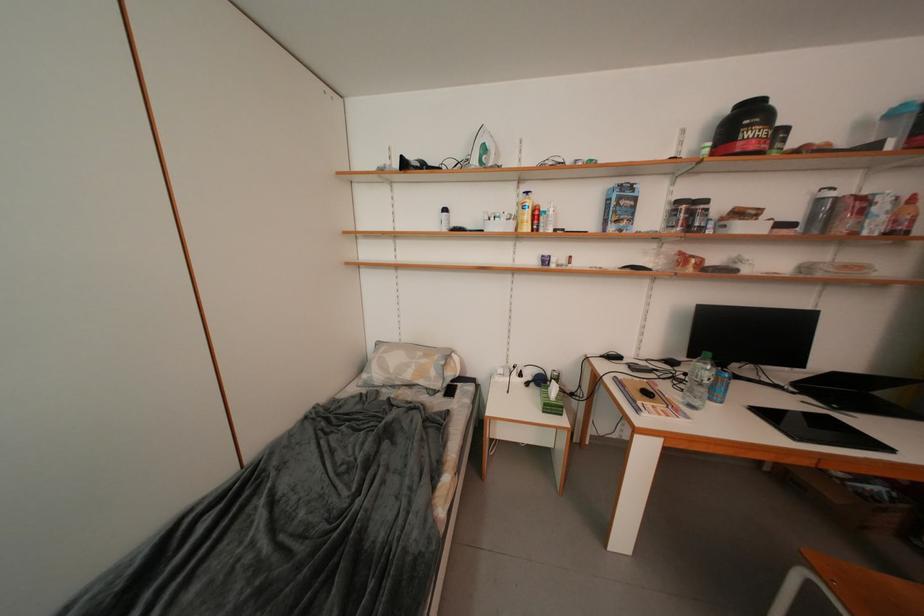
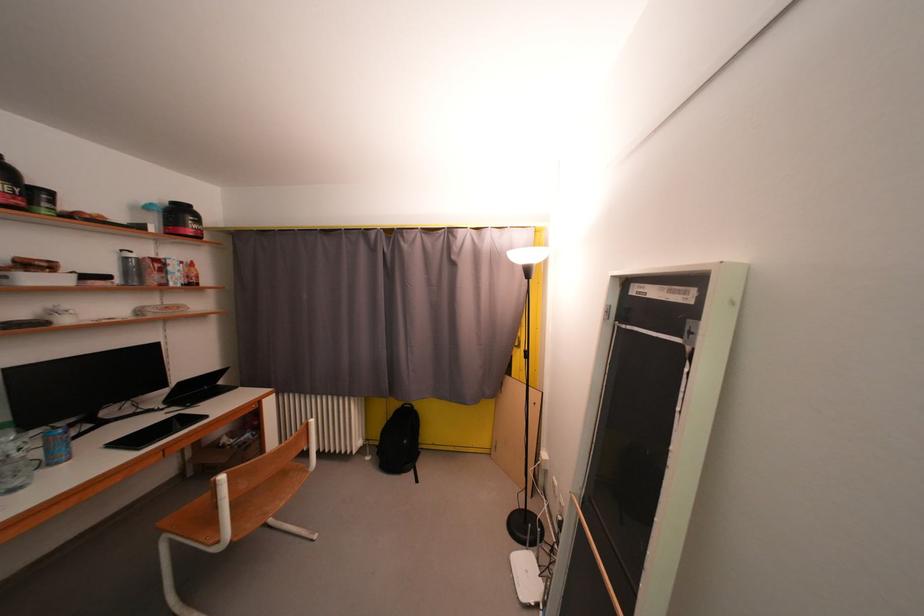
The point at (801, 387) is marked in the first image. Where is the corresponding point in the second image?

(174, 405)